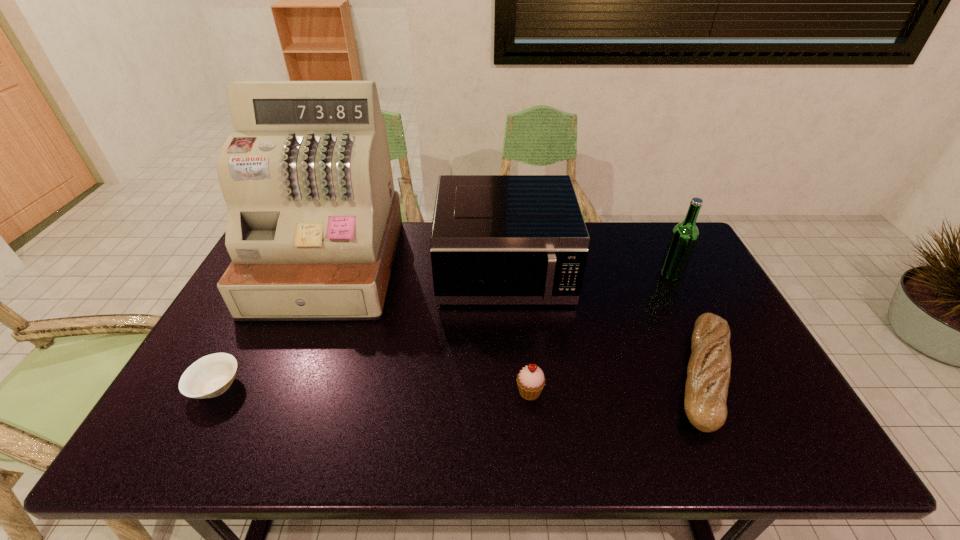
At what (x,y) coordinates should I click in order to perform the action: click on vacant region located on the left of the baguet. Please return your answer as a coordinate pair (x, y). Looking at the image, I should click on (580, 375).

Find the location of a particular element. vacant space located 0.320m on the right of the bowl is located at coordinates (372, 387).

I want to click on cash register at the far edge, so click(313, 223).

The height and width of the screenshot is (540, 960). Find the location of `microwave_oven positioned at the far edge`. microwave_oven positioned at the far edge is located at coordinates (495, 239).

The height and width of the screenshot is (540, 960). Identify the location of object located at the near edge. (708, 373).

Locate an element on the screen. The height and width of the screenshot is (540, 960). cash register that is at the left edge is located at coordinates (313, 223).

The height and width of the screenshot is (540, 960). Identify the location of bowl located at the left edge. (210, 376).

Locate an element on the screen. beer bottle that is at the right edge is located at coordinates (684, 236).

The height and width of the screenshot is (540, 960). In order to click on baguet that is at the right edge in this screenshot , I will do `click(708, 373)`.

This screenshot has width=960, height=540. In order to click on object located in the far left corner section of the desktop in this screenshot , I will do `click(313, 223)`.